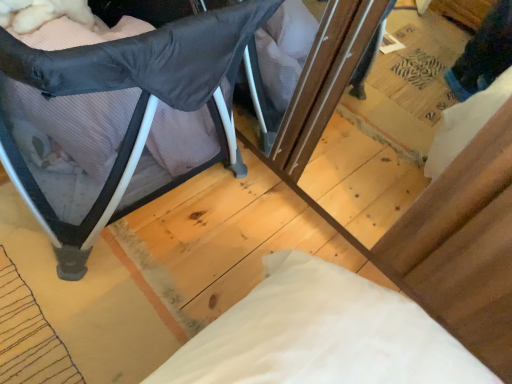
Question: Is point (162, 104) positioned closer to the camera than point (138, 102)?

Choices:
 (A) closer
 (B) farther

Answer: (B)

Question: From a real-world perspective, is pink striped pillow at left above or below matte black playpen at left?

Choices:
 (A) above
 (B) below

Answer: (B)

Question: In the image, is pink striped pillow at left positioned in front of or behind matte black playpen at left?

Choices:
 (A) behind
 (B) front

Answer: (A)

Question: Is point (30, 49) closer or farther from the camera than point (69, 152)?

Choices:
 (A) farther
 (B) closer

Answer: (B)

Question: From a real-world perspective, is matte black playpen at left above or below pink striped pillow at left?

Choices:
 (A) below
 (B) above

Answer: (B)

Question: In terms of width, does matte black playpen at left look wider or thinner when compared to pink striped pillow at left?

Choices:
 (A) thin
 (B) wide

Answer: (B)

Question: Is matte black playpen at left inside the boundaries of pink striped pillow at left, or outside?

Choices:
 (A) outside
 (B) inside

Answer: (A)